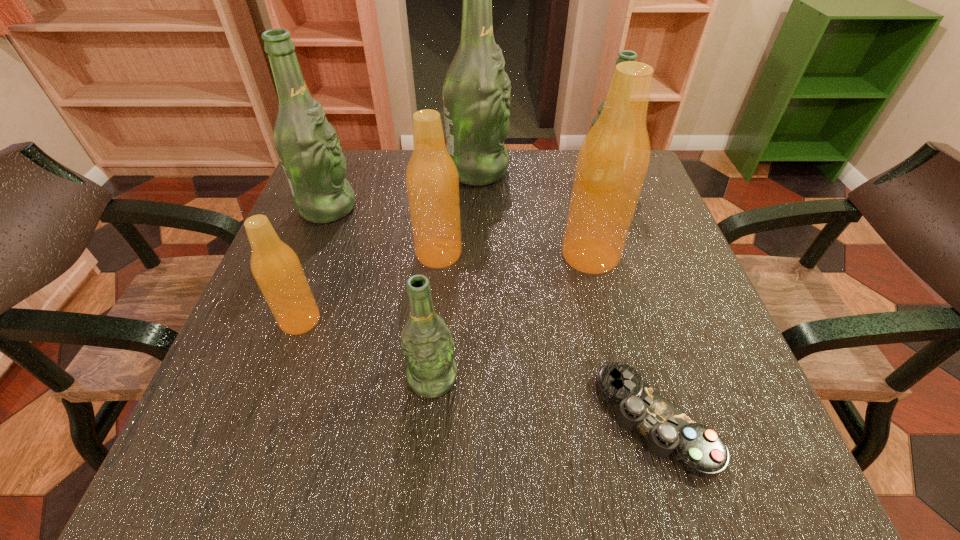
You are a GUI agent. You are given a task and a screenshot of the screen. Output one action in this format:
    pyautogui.click(x=<x>, y=<y>)
    Task: Click on the vacant area between the tallest object and the sixth farthest object
    The height and width of the screenshot is (540, 960).
    Given the screenshot: What is the action you would take?
    pyautogui.click(x=389, y=245)

Select which object appears as the closest to the rightmost green beer bottle. Please provide its 2D coordinates. Your answer should be formatted as a tuple, i.e. [(x, y)], where the tuple contains the x and y coordinates of a point satisfying the conditions above.

[(613, 159)]

Identify which object is the fifth closest to the control. Please provide its 2D coordinates. Your answer should be formatted as a tuple, i.e. [(x, y)], where the tuple contains the x and y coordinates of a point satisfying the conditions above.

[(626, 55)]

Select which beer bottle is the sixth closest to the shortest object. Please provide its 2D coordinates. Your answer should be formatted as a tuple, i.e. [(x, y)], where the tuple contains the x and y coordinates of a point satisfying the conditions above.

[(476, 92)]

I want to click on the fourth closest beer bottle relative to the leftmost green beer bottle, so click(x=427, y=345).

Identify which green beer bottle is located as the second nearest to the tallest object. Please provide its 2D coordinates. Your answer should be formatted as a tuple, i.e. [(x, y)], where the tuple contains the x and y coordinates of a point satisfying the conditions above.

[(308, 147)]

Select which green beer bottle appears as the closest to the biggest tan beer bottle. Please provide its 2D coordinates. Your answer should be formatted as a tuple, i.e. [(x, y)], where the tuple contains the x and y coordinates of a point satisfying the conditions above.

[(626, 55)]

Select which tan beer bottle appears as the closest to the smallest tan beer bottle. Please provide its 2D coordinates. Your answer should be formatted as a tuple, i.e. [(x, y)], where the tuple contains the x and y coordinates of a point satisfying the conditions above.

[(432, 182)]

Where is `tan beer bottle that is the closest one to the second tan beer bottle from left to right`? The image size is (960, 540). tan beer bottle that is the closest one to the second tan beer bottle from left to right is located at coordinates (275, 266).

The height and width of the screenshot is (540, 960). Find the location of `free space that satisfies the following two spatial constraints: 1. on the surface of the leftmost green beer bottle; 2. on the back side of the rightmost tan beer bottle`. free space that satisfies the following two spatial constraints: 1. on the surface of the leftmost green beer bottle; 2. on the back side of the rightmost tan beer bottle is located at coordinates (309, 255).